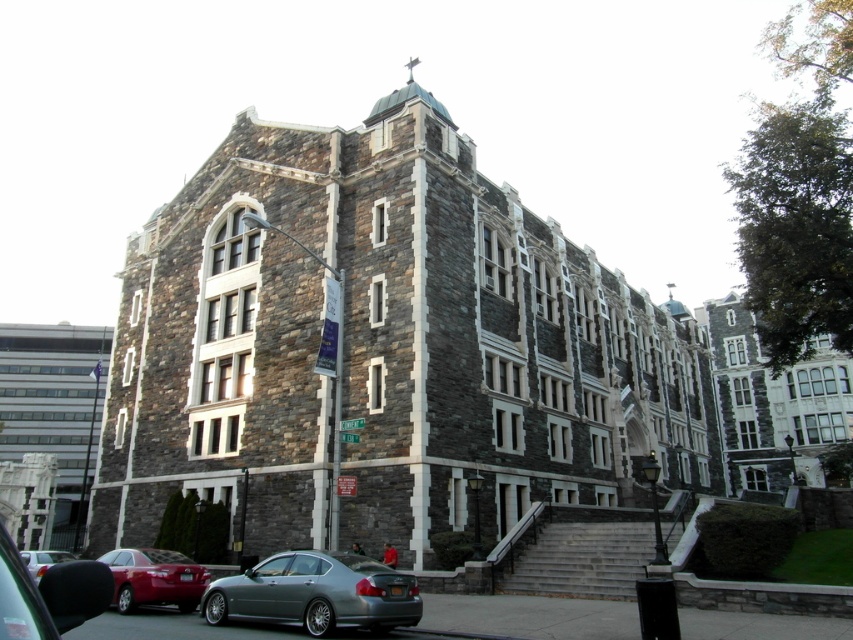
You are standing at the base of the wide steps in front of the gray stone church at center and the gray stone church at left. Which church is closer to you?

The gray stone church at center is closer to you because it is in front of the gray stone church at left.

You are standing on the ground in front of the stone building at center. If you look directly at the building, where would you see the point at coordinate (773,403) located?

The point at coordinate (773,403) is located on the stone building at center, which is the main structure in the image.